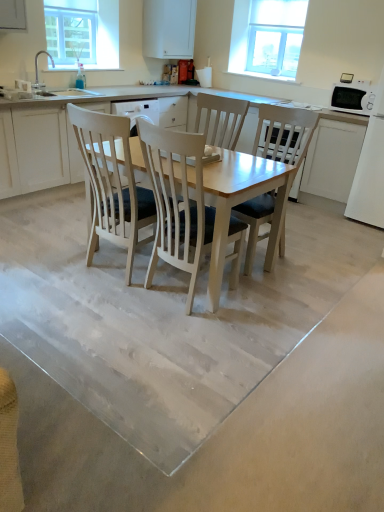
Question: From a real-world perspective, is light wood chair at center, the 1th chair in the right-to-left sequence, physically located above or below white wood chair at center, arranged as the 2th chair when viewed from the right?

Choices:
 (A) above
 (B) below

Answer: (A)

Question: Considering the positions of light wood chair at center, the 2th chair from the left, and white wood chair at center, arranged as the 2th chair when viewed from the right, in the image, is light wood chair at center, the 2th chair from the left, wider or thinner than white wood chair at center, arranged as the 2th chair when viewed from the right,?

Choices:
 (A) wide
 (B) thin

Answer: (A)

Question: Based on their relative distances, which object is nearer to the light wood chair at center, the 2th chair from the left?

Choices:
 (A) white wood chair at center, which appears as the 1th chair when viewed from the left
 (B) clear glass window screen at upper left
 (C) white matte cabinet at upper center, the second cabinetry viewed from the right
 (D) smooth concrete floor at center
 (E) white matte cabinet at left, marked as the third cabinetry in a right-to-left arrangement

Answer: (A)

Question: Which of these objects is positioned farthest from the smooth concrete floor at center?

Choices:
 (A) white matte cabinet at upper center, which is the second cabinetry from left to right
 (B) clear glass window at upper right
 (C) white matte cabinet at right, placed as the third cabinetry when sorted from left to right
 (D) light wood chair at center, the 1th chair in the right-to-left sequence
 (E) white wood chair at center, which appears as the 1th chair when viewed from the left

Answer: (A)